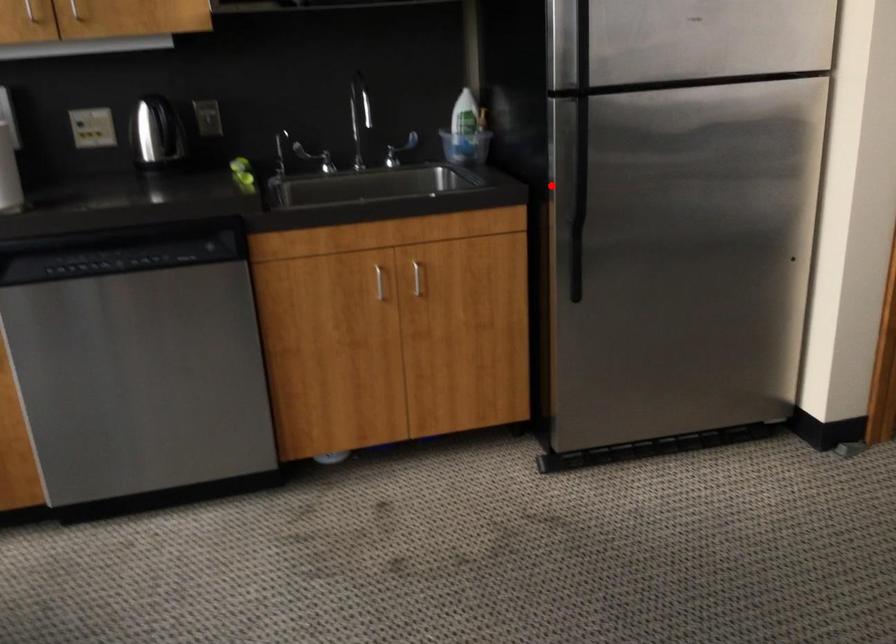
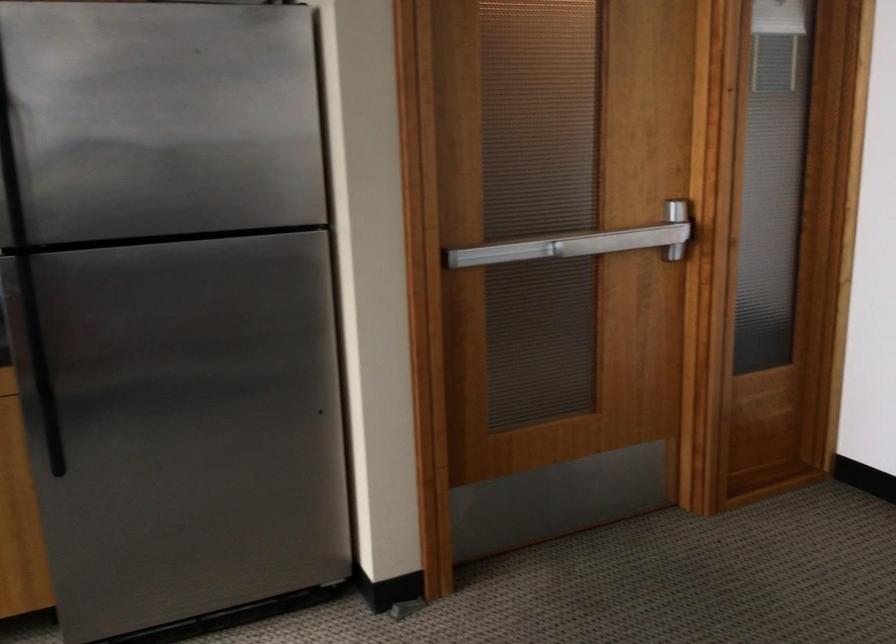
Find the pixel in the second image that matches the highlighted location in the first image.

(37, 352)